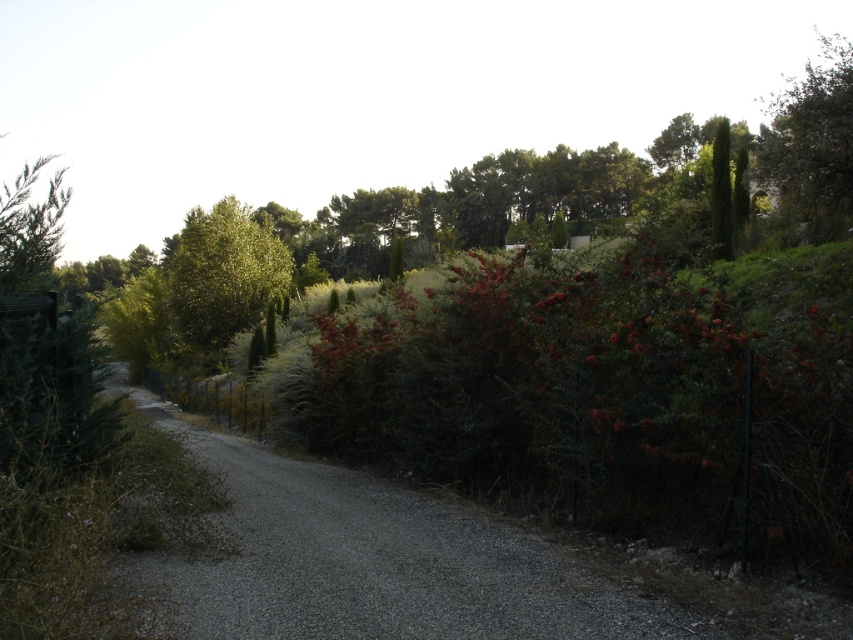
Can you confirm if gray gravel road at center is smaller than green leafy tree at upper right?

Correct, gray gravel road at center occupies less space than green leafy tree at upper right.

Which is behind, point (543, 621) or point (798, 140)?

The point (798, 140) is more distant.

Locate an element on the screen. gray gravel road at center is located at coordinates (387, 560).

Is green leafy tree at upper right above green leafy tree at center?

Yes, green leafy tree at upper right is above green leafy tree at center.

Which is behind, point (817, 234) or point (241, 316)?

Point (241, 316)

Locate an element on the screen. This screenshot has height=640, width=853. green leafy tree at upper right is located at coordinates (811, 145).

Is point (184, 625) positioned in front of point (201, 256)?

Yes, point (184, 625) is in front of point (201, 256).

From the picture: Who is more forward, (482, 618) or (267, 275)?

Point (482, 618)

The width and height of the screenshot is (853, 640). I want to click on gray gravel road at center, so click(387, 560).